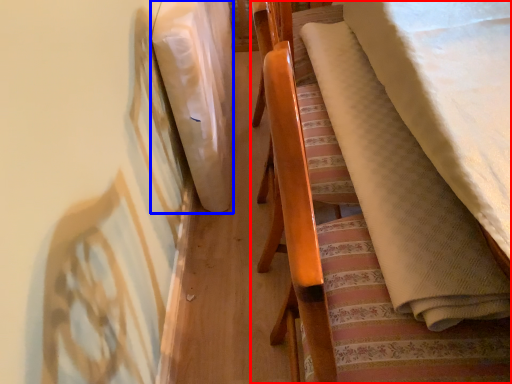
Question: Which point is further to the camera, furniture (highlighted by a red box) or blanket (highlighted by a blue box)?

Choices:
 (A) furniture
 (B) blanket

Answer: (B)